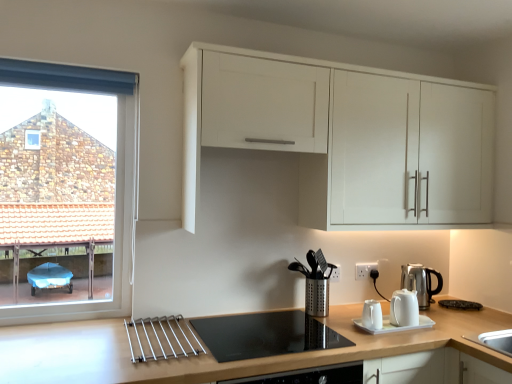
You are a GUI agent. You are given a task and a screenshot of the screen. Output one action in this format:
    pyautogui.click(x=<x>, y=<y>)
    Task: Click on the vacant area that is in front of silver metallic kettle at right, arranged as the second kitchen appliance when viewed from the front
    
    Given the screenshot: What is the action you would take?
    pyautogui.click(x=445, y=311)